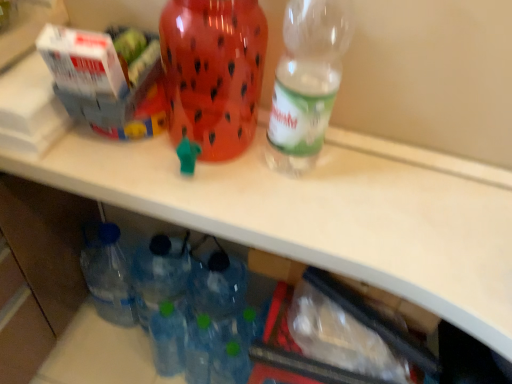
Question: Does white cardboard box at upper left, which appears as the second box when viewed from the left, have a larger size compared to white cardboard box at upper left, the second box viewed from the right?

Choices:
 (A) yes
 (B) no

Answer: (B)

Question: From the image's perspective, is white cardboard box at upper left, which appears as the second box when viewed from the left, under white cardboard box at upper left, the first box from the left?

Choices:
 (A) no
 (B) yes

Answer: (B)

Question: Is white cardboard box at upper left, which is the first box from right to left, closer to camera compared to white cardboard box at upper left, the first box from the left?

Choices:
 (A) no
 (B) yes

Answer: (A)

Question: Is white cardboard box at upper left, which is the first box from right to left, thinner than white cardboard box at upper left, the second box viewed from the right?

Choices:
 (A) yes
 (B) no

Answer: (A)

Question: Can you confirm if white cardboard box at upper left, which is the first box from right to left, is wider than white cardboard box at upper left, the second box viewed from the right?

Choices:
 (A) yes
 (B) no

Answer: (B)

Question: Is clear plastic bottle at upper right, positioned as the 1th bottle in right-to-left order, to the left or to the right of translucent plastic water jug at center, the second bottle when ordered from right to left, in the image?

Choices:
 (A) left
 (B) right

Answer: (B)

Question: Relative to translucent plastic water jug at center, the second bottle when ordered from right to left, is clear plastic bottle at upper right, positioned as the 1th bottle in right-to-left order, in front or behind?

Choices:
 (A) front
 (B) behind

Answer: (A)

Question: Choose the correct answer: Is clear plastic bottle at upper right, positioned as the 1th bottle in right-to-left order, inside translucent plastic water jug at center, which is counted as the 1th bottle, starting from the left, or outside it?

Choices:
 (A) inside
 (B) outside

Answer: (B)

Question: Based on their sizes in the image, would you say clear plastic bottle at upper right, which is counted as the 2th bottle, starting from the left, is bigger or smaller than translucent plastic water jug at center, the second bottle when ordered from right to left?

Choices:
 (A) small
 (B) big

Answer: (A)

Question: Visually, is white cardboard box at upper left, the first box from the left, positioned to the left or to the right of clear plastic bottle at upper right, which is counted as the 2th bottle, starting from the left?

Choices:
 (A) right
 (B) left

Answer: (B)

Question: Considering the positions of white cardboard box at upper left, the first box from the left, and clear plastic bottle at upper right, positioned as the 1th bottle in right-to-left order, in the image, is white cardboard box at upper left, the first box from the left, bigger or smaller than clear plastic bottle at upper right, positioned as the 1th bottle in right-to-left order,?

Choices:
 (A) small
 (B) big

Answer: (B)

Question: Considering the positions of point (17, 36) and point (309, 61), is point (17, 36) closer or farther from the camera than point (309, 61)?

Choices:
 (A) closer
 (B) farther

Answer: (A)

Question: Is white cardboard box at upper left, the first box from the left, situated inside clear plastic bottle at upper right, which is counted as the 2th bottle, starting from the left, or outside?

Choices:
 (A) outside
 (B) inside

Answer: (A)

Question: Would you say white cardboard box at upper left, which is the first box from right to left, is to the left or to the right of clear plastic bottle at upper right, positioned as the 1th bottle in right-to-left order, in the picture?

Choices:
 (A) left
 (B) right

Answer: (A)

Question: From their relative heights in the image, would you say white cardboard box at upper left, which is the first box from right to left, is taller or shorter than clear plastic bottle at upper right, which is counted as the 2th bottle, starting from the left?

Choices:
 (A) tall
 (B) short

Answer: (B)